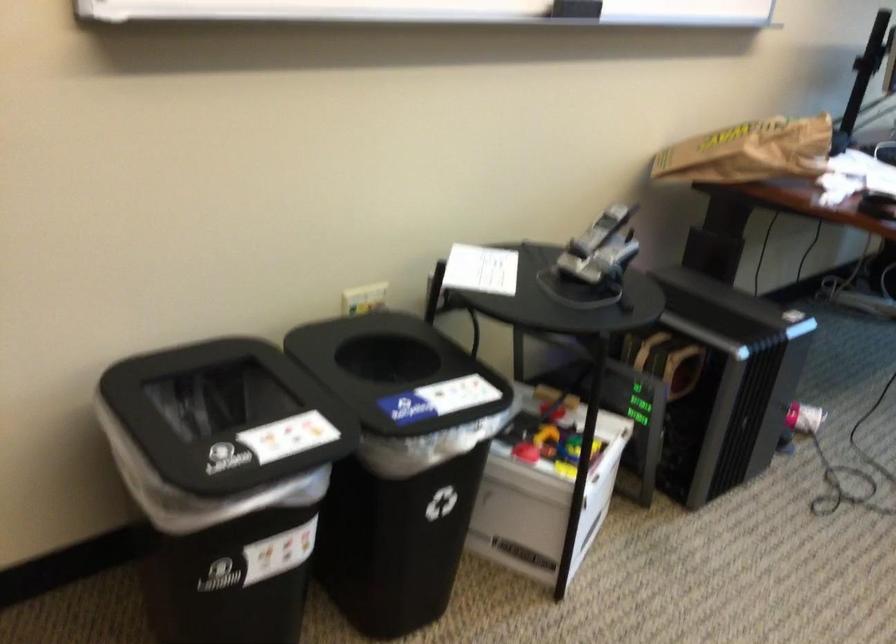
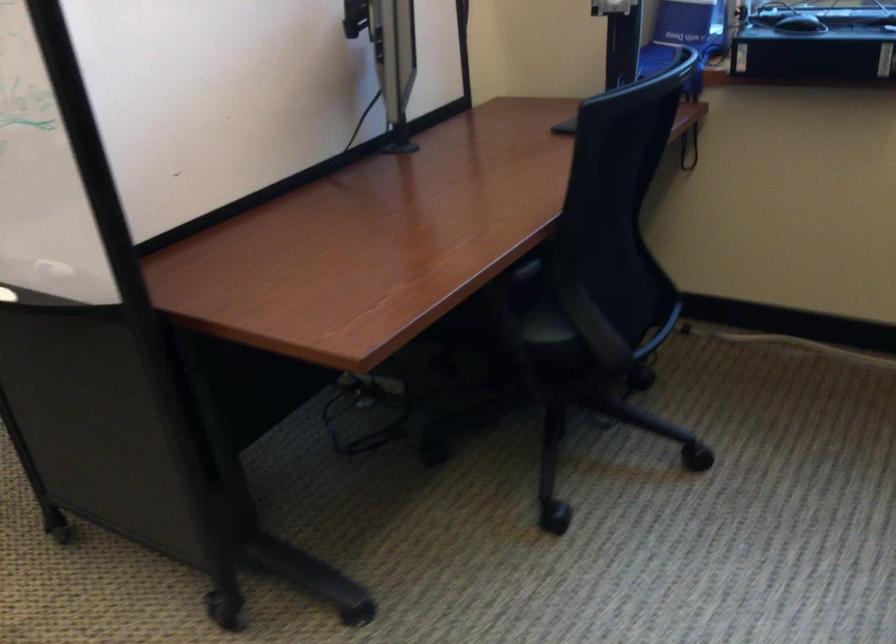
Question: Which direction would the cameraman need to move to produce the second image? Reply with the corresponding letter.

Choices:
 (A) Left
 (B) Right
 (C) Forward
 (D) Backward

Answer: (B)